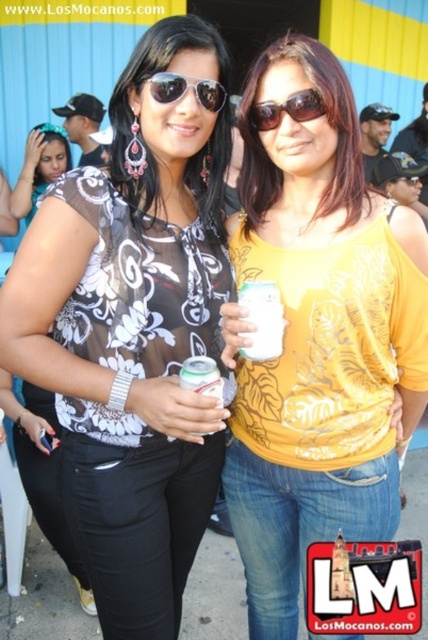
Question: Estimate the real-world distances between objects in this image. Which object is farther from the matte black sunglasses at center?

Choices:
 (A) yellow printed shirt at center
 (B) matte floral blouse at center
 (C) sunglasses at center

Answer: (A)

Question: Can you confirm if matte floral blouse at center is positioned to the left of yellow printed shirt at center?

Choices:
 (A) no
 (B) yes

Answer: (B)

Question: Estimate the real-world distances between objects in this image. Which object is closer to the matte black sunglasses at center?

Choices:
 (A) matte black top at center
 (B) yellow printed shirt at center
 (C) matte floral blouse at center

Answer: (C)

Question: Considering the relative positions of matte black top at center and sunglasses at center in the image provided, where is matte black top at center located with respect to sunglasses at center?

Choices:
 (A) right
 (B) left

Answer: (B)

Question: Which point is farther to the camera?

Choices:
 (A) matte floral blouse at center
 (B) matte black sunglasses at center

Answer: (B)

Question: Considering the relative positions of matte floral blouse at center and matte black top at center in the image provided, where is matte floral blouse at center located with respect to matte black top at center?

Choices:
 (A) below
 (B) above

Answer: (A)